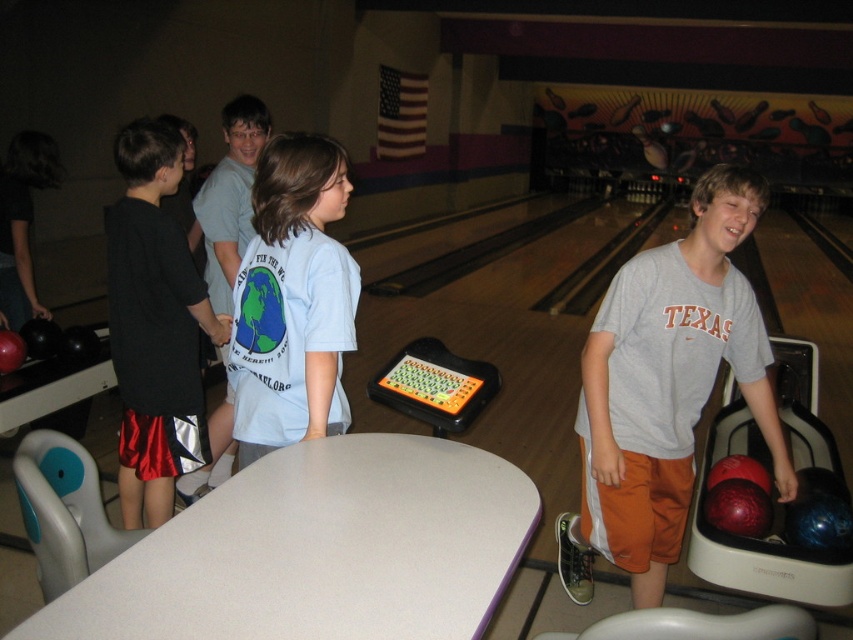
Question: Which object is the farthest from the gray cotton t-shirt at center?

Choices:
 (A) white matte table at center
 (B) light blue cotton shirt at center
 (C) light blue t-shirt at center
 (D) black satin shorts at left

Answer: (C)

Question: Is black satin shorts at left positioned in front of light blue t-shirt at center?

Choices:
 (A) no
 (B) yes

Answer: (B)

Question: In this image, where is light blue cotton shirt at center located relative to light blue t-shirt at center?

Choices:
 (A) left
 (B) right

Answer: (B)

Question: Considering the real-world distances, which object is farthest from the light blue t-shirt at center?

Choices:
 (A) black satin shorts at left
 (B) gray cotton t-shirt at center

Answer: (B)

Question: In this image, where is gray cotton t-shirt at center located relative to black satin shorts at left?

Choices:
 (A) above
 (B) below

Answer: (B)

Question: Which of the following is the closest to the observer?

Choices:
 (A) (207, 548)
 (B) (215, 289)

Answer: (A)